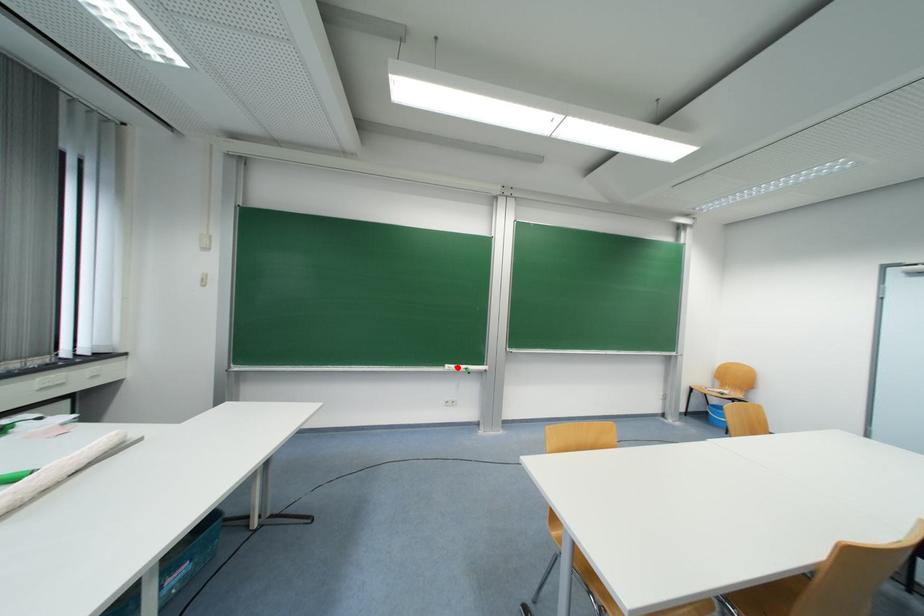
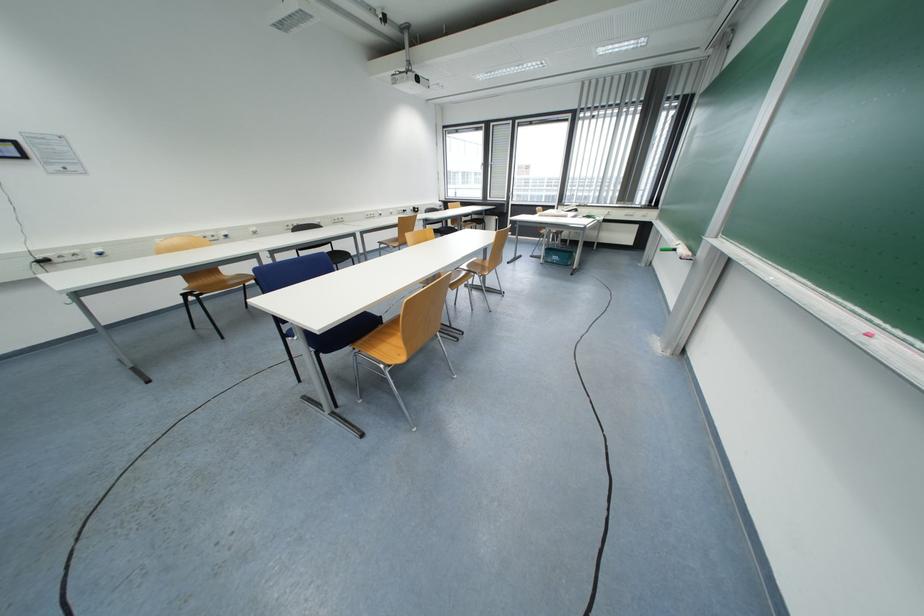
Locate, in the second image, the point that corresponds to the highlighted location in the first image.

(683, 244)